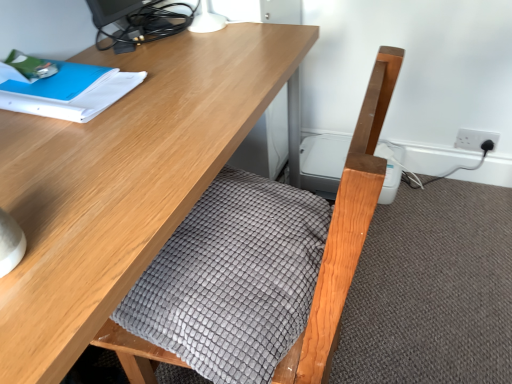
The image size is (512, 384). What are the coordinates of `free space above gray textured blanket at center (from a real-world perspective)` in the screenshot? It's located at (219, 247).